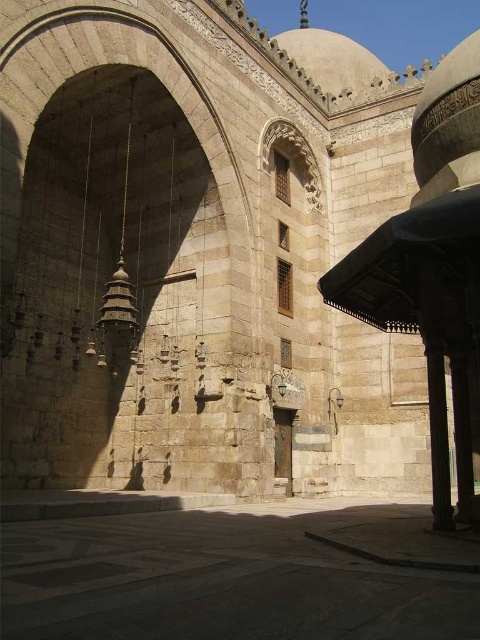
Question: Which point is farther to the camera?

Choices:
 (A) gray stone courtyard at lower center
 (B) brown stone pillar at right

Answer: (B)

Question: Can you confirm if gray stone courtyard at lower center is wider than brown stone pillar at right?

Choices:
 (A) yes
 (B) no

Answer: (A)

Question: In this image, where is gray stone courtyard at lower center located relative to brown stone pillar at right?

Choices:
 (A) above
 (B) below

Answer: (B)

Question: Is gray stone courtyard at lower center thinner than brown stone pillar at right?

Choices:
 (A) no
 (B) yes

Answer: (A)